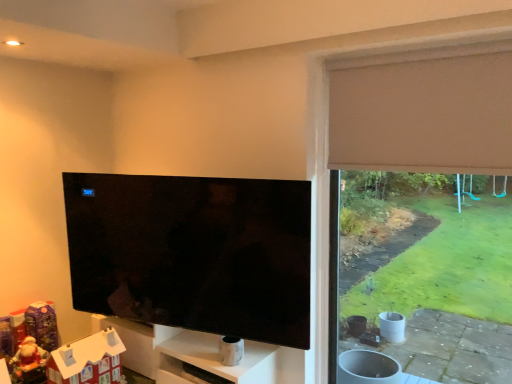
Question: Is point (399, 72) positioned closer to the camera than point (111, 332)?

Choices:
 (A) farther
 (B) closer

Answer: (B)

Question: Considering the positions of beige fabric curtain at upper right and white cardboard house at lower left in the image, is beige fabric curtain at upper right wider or thinner than white cardboard house at lower left?

Choices:
 (A) thin
 (B) wide

Answer: (A)

Question: Estimate the real-world distances between objects in this image. Which object is farther from the white marble shelf at lower center?

Choices:
 (A) beige fabric window frame at right
 (B) beige fabric curtain at upper right
 (C) matte black tv at center
 (D) white cardboard house at lower left

Answer: (B)

Question: Which is farther from the beige fabric window frame at right?

Choices:
 (A) white cardboard house at lower left
 (B) matte black tv at center
 (C) white marble shelf at lower center
 (D) beige fabric curtain at upper right

Answer: (A)